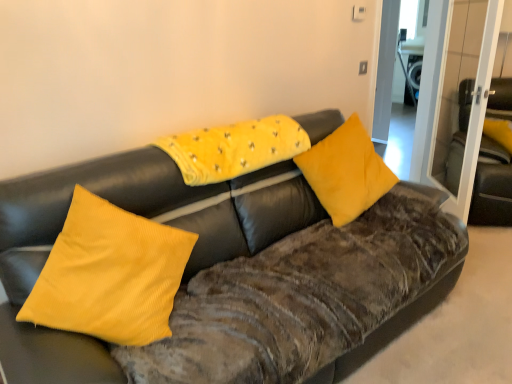
Where is `yellow corduroy pillow at upper center, the 2th pillow when ordered from left to right`? The image size is (512, 384). yellow corduroy pillow at upper center, the 2th pillow when ordered from left to right is located at coordinates (234, 148).

What do you see at coordinates (346, 172) in the screenshot?
I see `yellow corduroy pillow at center, acting as the 1th pillow starting from the right` at bounding box center [346, 172].

What do you see at coordinates (437, 90) in the screenshot? Image resolution: width=512 pixels, height=384 pixels. I see `transparent glass door at upper right` at bounding box center [437, 90].

You are a GUI agent. You are given a task and a screenshot of the screen. Output one action in this format:
    pyautogui.click(x=<x>, y=<y>)
    Task: Click on the transparent glass door at upper right
    Image resolution: width=512 pixels, height=384 pixels.
    Given the screenshot: What is the action you would take?
    pyautogui.click(x=437, y=90)

What do you see at coordinates (110, 274) in the screenshot? I see `yellow corduroy pillow at left, marked as the 1th pillow in a left-to-right arrangement` at bounding box center [110, 274].

Find the location of `yellow corduroy pillow at upper center, the second pillow in the right-to-left sequence`. yellow corduroy pillow at upper center, the second pillow in the right-to-left sequence is located at coordinates (234, 148).

Considering the relative sizes of yellow corduroy pillow at upper center, the second pillow in the right-to-left sequence, and yellow corduroy pillow at center, acting as the 1th pillow starting from the right, in the image provided, is yellow corduroy pillow at upper center, the second pillow in the right-to-left sequence, bigger than yellow corduroy pillow at center, acting as the 1th pillow starting from the right,?

Actually, yellow corduroy pillow at upper center, the second pillow in the right-to-left sequence, might be smaller than yellow corduroy pillow at center, acting as the 1th pillow starting from the right.

From the image's perspective, which one is positioned higher, yellow corduroy pillow at upper center, the 2th pillow when ordered from left to right, or yellow corduroy pillow at center, which appears as the 3th pillow when viewed from the left?

yellow corduroy pillow at upper center, the 2th pillow when ordered from left to right, from the image's perspective.

Is yellow corduroy pillow at upper center, the second pillow in the right-to-left sequence, not near yellow corduroy pillow at center, which appears as the 3th pillow when viewed from the left?

No, yellow corduroy pillow at upper center, the second pillow in the right-to-left sequence, is not far away from yellow corduroy pillow at center, which appears as the 3th pillow when viewed from the left.

Considering the sizes of objects yellow corduroy pillow at upper center, the second pillow in the right-to-left sequence, and yellow corduroy pillow at center, which appears as the 3th pillow when viewed from the left, in the image provided, who is wider, yellow corduroy pillow at upper center, the second pillow in the right-to-left sequence, or yellow corduroy pillow at center, which appears as the 3th pillow when viewed from the left,?

Wider between the two is yellow corduroy pillow at upper center, the second pillow in the right-to-left sequence.

Visually, is yellow corduroy pillow at left, marked as the 1th pillow in a left-to-right arrangement, positioned to the left or to the right of yellow corduroy pillow at upper center, the 2th pillow when ordered from left to right?

In the image, yellow corduroy pillow at left, marked as the 1th pillow in a left-to-right arrangement, appears on the left side of yellow corduroy pillow at upper center, the 2th pillow when ordered from left to right.

Is yellow corduroy pillow at left, acting as the 3th pillow starting from the right, spatially inside yellow corduroy pillow at upper center, the 2th pillow when ordered from left to right, or outside of it?

yellow corduroy pillow at left, acting as the 3th pillow starting from the right, is located beyond the bounds of yellow corduroy pillow at upper center, the 2th pillow when ordered from left to right.

From the image's perspective, would you say yellow corduroy pillow at left, marked as the 1th pillow in a left-to-right arrangement, is positioned over yellow corduroy pillow at upper center, the 2th pillow when ordered from left to right?

Actually, yellow corduroy pillow at left, marked as the 1th pillow in a left-to-right arrangement, appears below yellow corduroy pillow at upper center, the 2th pillow when ordered from left to right, in the image.

From the image's perspective, is transparent glass door at upper right located above or below yellow corduroy pillow at left, marked as the 1th pillow in a left-to-right arrangement?

From the image's perspective, transparent glass door at upper right appears above yellow corduroy pillow at left, marked as the 1th pillow in a left-to-right arrangement.

Is transparent glass door at upper right aimed at yellow corduroy pillow at left, marked as the 1th pillow in a left-to-right arrangement?

No, transparent glass door at upper right is not turned towards yellow corduroy pillow at left, marked as the 1th pillow in a left-to-right arrangement.

Which object is thinner, transparent glass door at upper right or yellow corduroy pillow at left, marked as the 1th pillow in a left-to-right arrangement?

transparent glass door at upper right.

Would you say transparent glass door at upper right is a long distance from yellow corduroy pillow at left, acting as the 3th pillow starting from the right?

Absolutely, transparent glass door at upper right is distant from yellow corduroy pillow at left, acting as the 3th pillow starting from the right.

Locate an element on the screen. pillow that is the 1st one when counting downward from the transparent glass door at upper right (from the image's perspective) is located at coordinates (234, 148).

Which of these two, yellow corduroy pillow at upper center, the 2th pillow when ordered from left to right, or transparent glass door at upper right, stands taller?

transparent glass door at upper right.

Is yellow corduroy pillow at upper center, the 2th pillow when ordered from left to right, closer to camera compared to transparent glass door at upper right?

Yes, it is.

From the image's perspective, who appears lower, yellow corduroy pillow at upper center, the 2th pillow when ordered from left to right, or transparent glass door at upper right?

yellow corduroy pillow at upper center, the 2th pillow when ordered from left to right, is shown below in the image.

Is point (173, 241) closer to viewer compared to point (489, 215)?

Yes, point (173, 241) is in front of point (489, 215).

Is yellow corduroy pillow at left, marked as the 1th pillow in a left-to-right arrangement, situated inside velvet black armchair at right or outside?

yellow corduroy pillow at left, marked as the 1th pillow in a left-to-right arrangement, is not enclosed by velvet black armchair at right.

Looking at this image, are yellow corduroy pillow at left, acting as the 3th pillow starting from the right, and velvet black armchair at right far apart?

Yes, yellow corduroy pillow at left, acting as the 3th pillow starting from the right, and velvet black armchair at right are quite far apart.

Which object is positioned more to the right, yellow corduroy pillow at left, acting as the 3th pillow starting from the right, or velvet black armchair at right?

velvet black armchair at right is more to the right.

Considering the sizes of yellow corduroy pillow at center, which appears as the 3th pillow when viewed from the left, and yellow corduroy pillow at left, acting as the 3th pillow starting from the right, in the image, is yellow corduroy pillow at center, which appears as the 3th pillow when viewed from the left, wider or thinner than yellow corduroy pillow at left, acting as the 3th pillow starting from the right,?

Considering their sizes, yellow corduroy pillow at center, which appears as the 3th pillow when viewed from the left, looks slimmer than yellow corduroy pillow at left, acting as the 3th pillow starting from the right.

Is yellow corduroy pillow at center, acting as the 1th pillow starting from the right, positioned with its back to yellow corduroy pillow at left, acting as the 3th pillow starting from the right?

No, yellow corduroy pillow at left, acting as the 3th pillow starting from the right, is not at the back of yellow corduroy pillow at center, acting as the 1th pillow starting from the right.

How many degrees apart are the facing directions of yellow corduroy pillow at center, which appears as the 3th pillow when viewed from the left, and yellow corduroy pillow at left, acting as the 3th pillow starting from the right?

The facing directions of yellow corduroy pillow at center, which appears as the 3th pillow when viewed from the left, and yellow corduroy pillow at left, acting as the 3th pillow starting from the right, are 14.4 degrees apart.

Visually, is yellow corduroy pillow at center, acting as the 1th pillow starting from the right, positioned to the left or to the right of yellow corduroy pillow at left, marked as the 1th pillow in a left-to-right arrangement?

In the image, yellow corduroy pillow at center, acting as the 1th pillow starting from the right, appears on the right side of yellow corduroy pillow at left, marked as the 1th pillow in a left-to-right arrangement.

Are velvet black armchair at right and velvet brown couch at center far apart?

Yes, velvet black armchair at right and velvet brown couch at center are located far from each other.

Is velvet black armchair at right oriented towards velvet brown couch at center?

No, velvet black armchair at right does not turn towards velvet brown couch at center.

Where is `armchair lying behind the velvet brown couch at center`? armchair lying behind the velvet brown couch at center is located at coordinates [x=492, y=186].

Is velvet black armchair at right in front of velvet brown couch at center?

No.

Identify the location of pillow that is above the yellow corduroy pillow at center, acting as the 1th pillow starting from the right (from a real-world perspective). This screenshot has width=512, height=384. (234, 148).

Starting from the yellow corduroy pillow at left, acting as the 3th pillow starting from the right, which pillow is the 1st one behind? Please provide its 2D coordinates.

[(234, 148)]

Estimate the real-world distances between objects in this image. Which object is further from velvet black armchair at right, velvet brown couch at center or yellow corduroy pillow at upper center, the 2th pillow when ordered from left to right?

Among the two, velvet brown couch at center is located further to velvet black armchair at right.

Considering their positions, is transparent glass door at upper right positioned closer to velvet black armchair at right than yellow corduroy pillow at upper center, the 2th pillow when ordered from left to right?

Among the two, transparent glass door at upper right is located nearer to velvet black armchair at right.

Estimate the real-world distances between objects in this image. Which object is further from yellow corduroy pillow at upper center, the second pillow in the right-to-left sequence, yellow corduroy pillow at left, acting as the 3th pillow starting from the right, or transparent glass door at upper right?

transparent glass door at upper right is positioned further to the anchor yellow corduroy pillow at upper center, the second pillow in the right-to-left sequence.

Considering their positions, is velvet brown couch at center positioned closer to yellow corduroy pillow at center, which appears as the 3th pillow when viewed from the left, than yellow corduroy pillow at upper center, the 2th pillow when ordered from left to right?

yellow corduroy pillow at upper center, the 2th pillow when ordered from left to right, is closer to yellow corduroy pillow at center, which appears as the 3th pillow when viewed from the left.

Based on their spatial positions, is velvet black armchair at right or velvet brown couch at center further from transparent glass door at upper right?

velvet brown couch at center is further to transparent glass door at upper right.

From the picture: Looking at the image, which one is located closer to velvet brown couch at center, yellow corduroy pillow at left, marked as the 1th pillow in a left-to-right arrangement, or transparent glass door at upper right?

Among the two, yellow corduroy pillow at left, marked as the 1th pillow in a left-to-right arrangement, is located nearer to velvet brown couch at center.

From the image, which object appears to be farther from transparent glass door at upper right, velvet brown couch at center or yellow corduroy pillow at center, which appears as the 3th pillow when viewed from the left?

The object further to transparent glass door at upper right is velvet brown couch at center.

From the image, which object appears to be farther from velvet brown couch at center, yellow corduroy pillow at center, acting as the 1th pillow starting from the right, or velvet black armchair at right?

velvet black armchair at right lies further to velvet brown couch at center than the other object.

Locate an element on the screen. The height and width of the screenshot is (384, 512). glass door between yellow corduroy pillow at upper center, the second pillow in the right-to-left sequence, and velvet black armchair at right is located at coordinates (437, 90).

Locate an element on the screen. This screenshot has width=512, height=384. pillow between yellow corduroy pillow at upper center, the 2th pillow when ordered from left to right, and velvet black armchair at right is located at coordinates (346, 172).

Find the location of a particular element. The height and width of the screenshot is (384, 512). pillow between velvet brown couch at center and velvet black armchair at right from left to right is located at coordinates (346, 172).

Where is `pillow between velvet brown couch at center and yellow corduroy pillow at upper center, the 2th pillow when ordered from left to right, in the front-back direction`? pillow between velvet brown couch at center and yellow corduroy pillow at upper center, the 2th pillow when ordered from left to right, in the front-back direction is located at coordinates (110, 274).